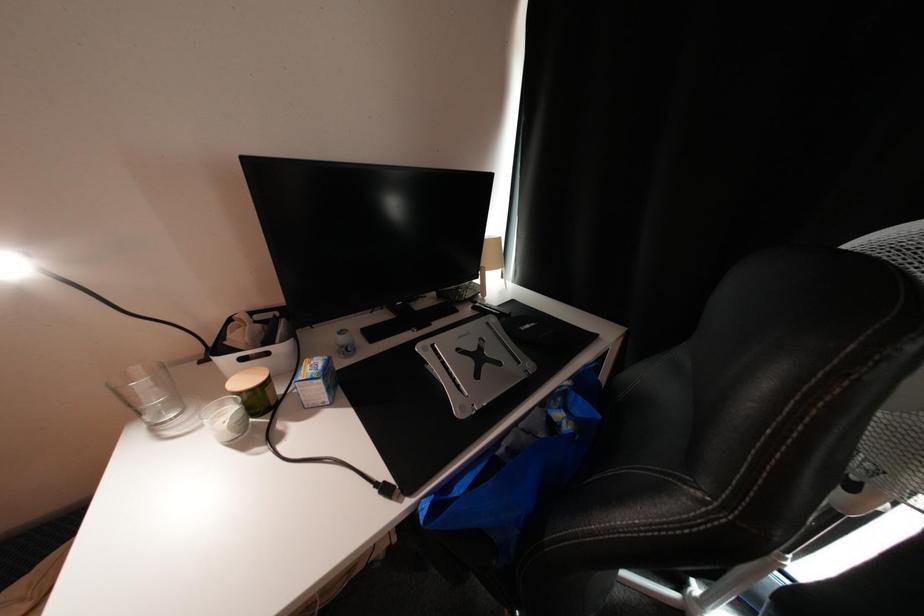
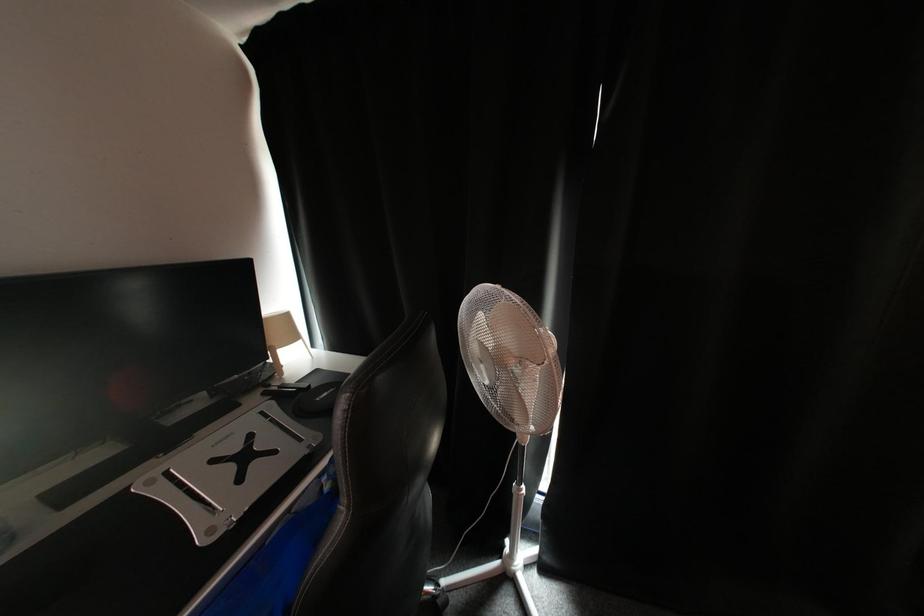
Question: Based on the continuous images, in which direction is the camera rotating? Reply with the corresponding letter.

Choices:
 (A) Left
 (B) Right
 (C) Up
 (D) Down

Answer: (B)